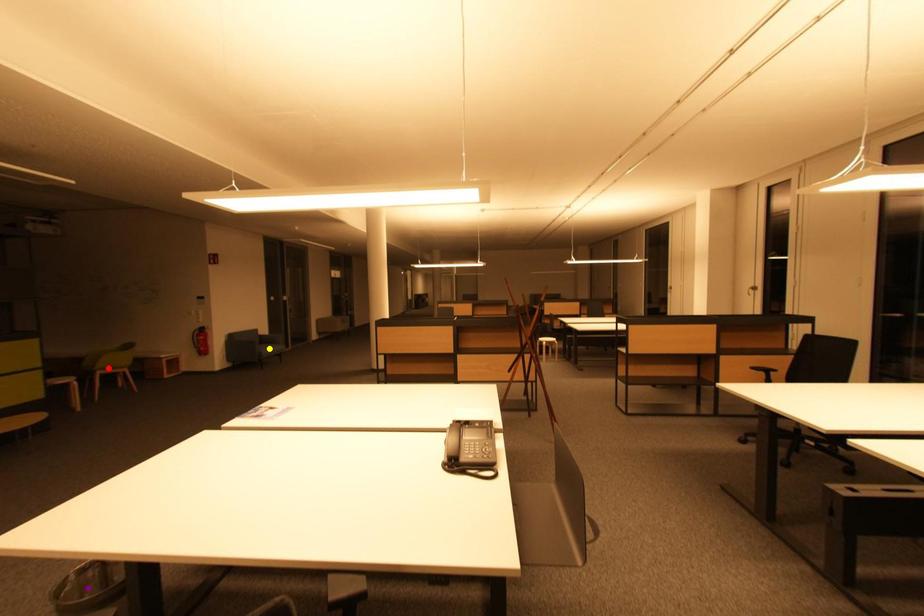
Order these from nearest to farthest:
- purple point
- red point
- yellow point

yellow point → red point → purple point